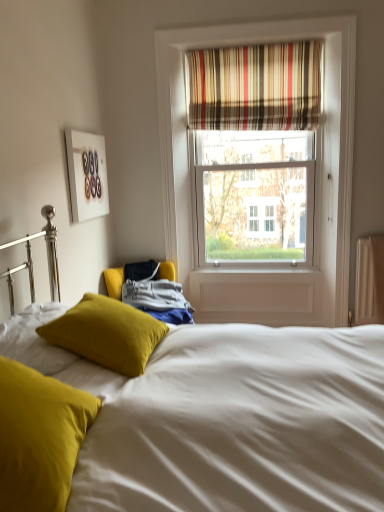
At what (x,y) coordinates should I click in order to perform the action: click on empty space that is ontop of striped fabric curtain at upper center (from a real-world perspective). Please return your answer as a coordinate pair (x, y). Looking at the image, I should click on (240, 44).